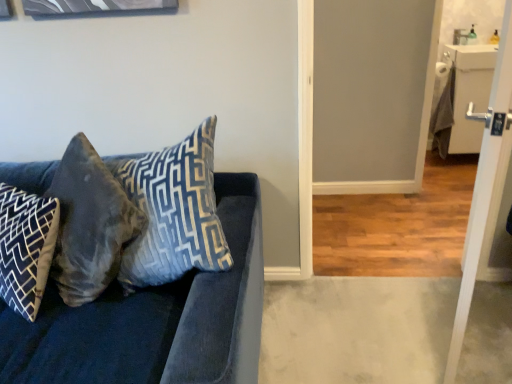
Question: Considering the relative positions of blue-patterned fabric pillow at left, which is the third pillow from right to left, and white glossy door at right in the image provided, is blue-patterned fabric pillow at left, which is the third pillow from right to left, in front of white glossy door at right?

Choices:
 (A) yes
 (B) no

Answer: (B)

Question: Could white glossy door at right be considered to be inside blue-patterned fabric pillow at left, which is the 1th pillow in left-to-right order?

Choices:
 (A) no
 (B) yes

Answer: (A)

Question: From the image's perspective, would you say blue-patterned fabric pillow at left, which is the third pillow from right to left, is shown under white glossy door at right?

Choices:
 (A) yes
 (B) no

Answer: (A)

Question: Does blue-patterned fabric pillow at left, which is the third pillow from right to left, turn towards white glossy door at right?

Choices:
 (A) no
 (B) yes

Answer: (A)

Question: Does blue-patterned fabric pillow at left, which is the third pillow from right to left, appear on the left side of white glossy door at right?

Choices:
 (A) yes
 (B) no

Answer: (A)

Question: Based on their positions, is blue-patterned fabric pillow at left, which is the third pillow from right to left, located to the left or right of velvet gray pillow at left, which is the 2th pillow in left-to-right order?

Choices:
 (A) left
 (B) right

Answer: (A)

Question: Considering the positions of point (1, 274) and point (76, 263), is point (1, 274) closer or farther from the camera than point (76, 263)?

Choices:
 (A) closer
 (B) farther

Answer: (A)

Question: Considering the positions of blue-patterned fabric pillow at left, which is the 1th pillow in left-to-right order, and velvet gray pillow at left, the second pillow from the right, in the image, is blue-patterned fabric pillow at left, which is the 1th pillow in left-to-right order, wider or thinner than velvet gray pillow at left, the second pillow from the right,?

Choices:
 (A) thin
 (B) wide

Answer: (B)

Question: Is blue-patterned fabric pillow at left, which is the third pillow from right to left, in front of or behind velvet gray pillow at left, the second pillow from the right, in the image?

Choices:
 (A) behind
 (B) front

Answer: (A)

Question: Choose the correct answer: Is velvet blue couch at left inside velvet blue pillow at center, the 1th pillow viewed from the right, or outside it?

Choices:
 (A) outside
 (B) inside

Answer: (A)

Question: Based on their sizes in the image, would you say velvet blue couch at left is bigger or smaller than velvet blue pillow at center, the 1th pillow viewed from the right?

Choices:
 (A) small
 (B) big

Answer: (B)

Question: From a real-world perspective, relative to velvet blue pillow at center, the 3th pillow in the left-to-right sequence, is velvet blue couch at left vertically above or below?

Choices:
 (A) below
 (B) above

Answer: (A)

Question: Is velvet blue couch at left wider or thinner than velvet blue pillow at center, the 1th pillow viewed from the right?

Choices:
 (A) thin
 (B) wide

Answer: (B)

Question: From a real-world perspective, relative to velvet gray pillow at left, the second pillow from the right, is velvet blue pillow at center, the 3th pillow in the left-to-right sequence, vertically above or below?

Choices:
 (A) below
 (B) above

Answer: (B)

Question: Would you say velvet blue pillow at center, the 1th pillow viewed from the right, is inside or outside velvet gray pillow at left, the second pillow from the right?

Choices:
 (A) inside
 (B) outside

Answer: (B)